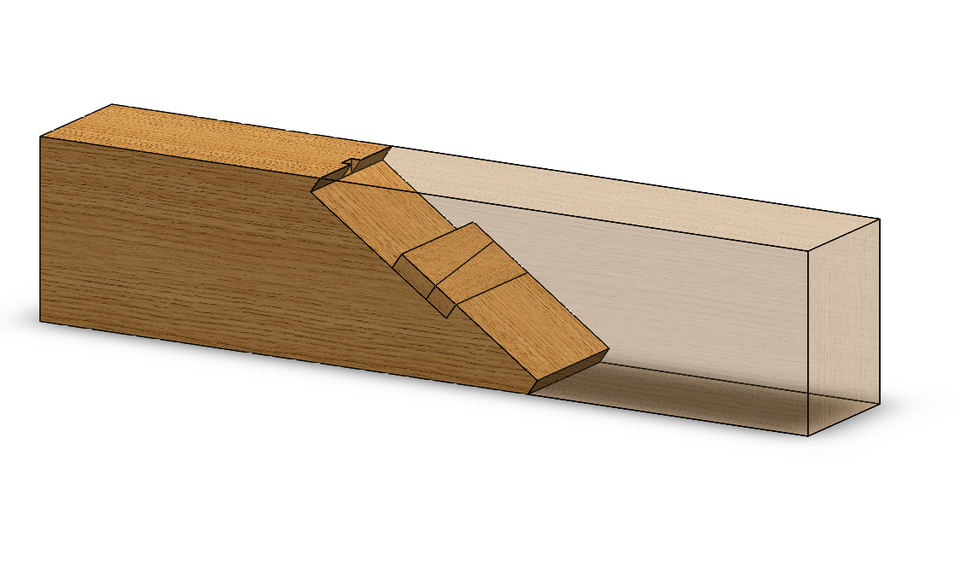
Where is `corners`? corners is located at coordinates (872, 222), (53, 314), (61, 134), (821, 419).